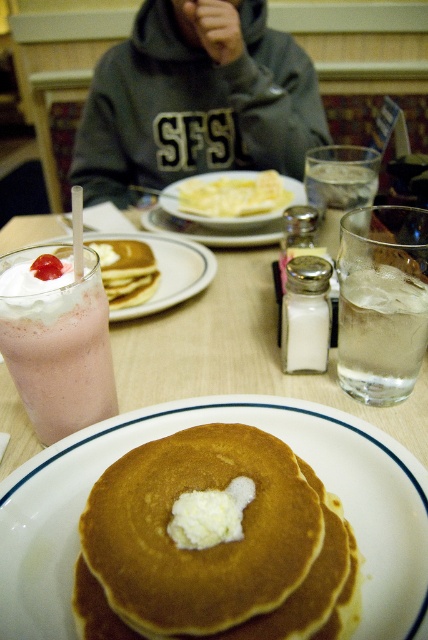
Question: Does golden brown pancake at center appear on the left side of clear glass ice water at right?

Choices:
 (A) no
 (B) yes

Answer: (B)

Question: Which point is closer to the camera?

Choices:
 (A) golden brown pancake at center
 (B) yellow fried egg at center
 (C) strawberry milkshake at left
 (D) gray hoodie at upper center

Answer: (A)

Question: Can you confirm if strawberry milkshake at left is positioned to the left of yellow fried egg at center?

Choices:
 (A) no
 (B) yes

Answer: (B)

Question: Does golden brown pancake at center have a smaller size compared to yellow fried egg at center?

Choices:
 (A) no
 (B) yes

Answer: (B)

Question: Which object appears farthest from the camera in this image?

Choices:
 (A) clear glass ice water at right
 (B) golden brown pancake at center
 (C) gray hoodie at upper center
 (D) yellow fried egg at center

Answer: (C)

Question: Among these points, which one is farthest from the camera?

Choices:
 (A) 121,467
 (B) 273,196
 (C) 39,336
 (D) 372,321

Answer: (B)